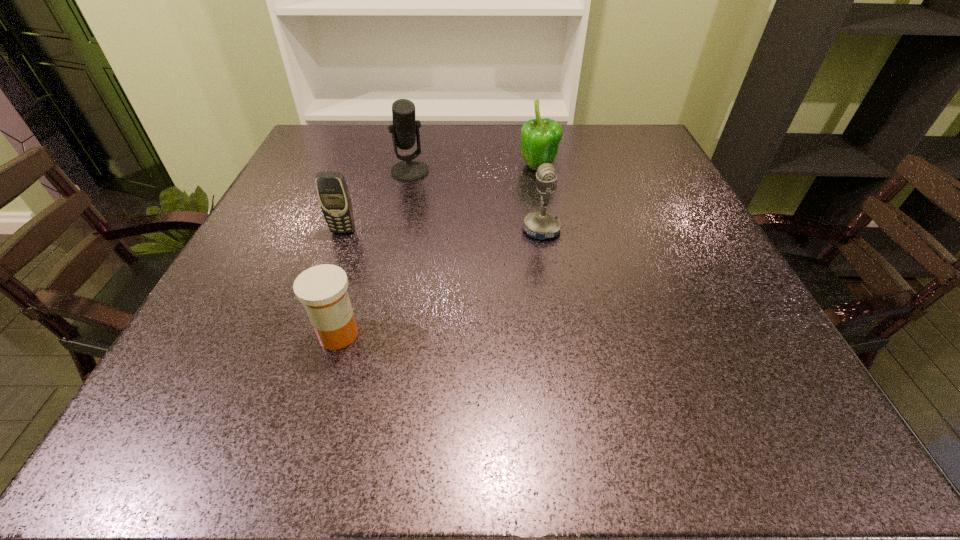
At what (x,y) coordinates should I click in order to perform the action: click on the left microphone. Please return your answer as a coordinate pair (x, y). The height and width of the screenshot is (540, 960). Looking at the image, I should click on (405, 131).

I want to click on bell pepper, so click(540, 138).

I want to click on the nearer microphone, so click(540, 225).

Where is `the right microphone`? This screenshot has height=540, width=960. the right microphone is located at coordinates (540, 225).

Identify the location of cellular telephone. (333, 194).

You are a GUI agent. You are given a task and a screenshot of the screen. Output one action in this format:
    pyautogui.click(x=<x>, y=<y>)
    Task: Click on the nearest object
    
    Given the screenshot: What is the action you would take?
    pyautogui.click(x=322, y=289)

Identify the location of the shortest object. The width and height of the screenshot is (960, 540). (322, 289).

I want to click on blank space located on the back of the farther microphone, so click(x=415, y=148).

Identify the location of vacant space located on the back of the bell pepper. This screenshot has width=960, height=540. (533, 140).

Find the location of a particular element. This screenshot has height=540, width=960. vacant point located 0.140m on the front-facing side of the shorter microphone is located at coordinates (454, 230).